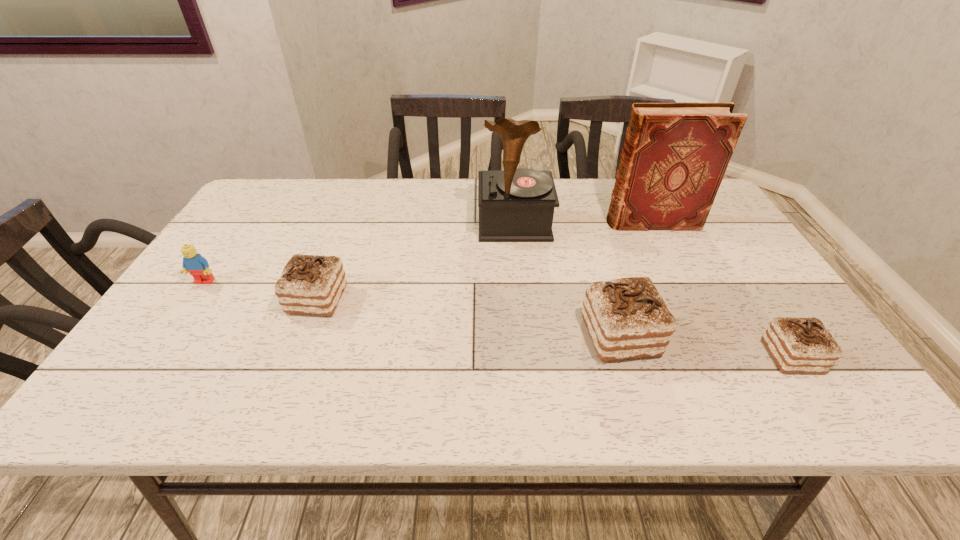
This screenshot has width=960, height=540. Identify the location of hardback book that is positioned at the right edge. (675, 155).

Locate an element on the screen. Image resolution: width=960 pixels, height=540 pixels. object that is at the far right corner is located at coordinates (675, 155).

I want to click on object present at the near right corner, so click(797, 345).

The width and height of the screenshot is (960, 540). I want to click on free space at the far edge of the desktop, so click(x=384, y=186).

Where is `free space at the near edge`? This screenshot has width=960, height=540. free space at the near edge is located at coordinates (665, 368).

In the image, there is a desktop. Where is `vacant region at the left edge`? vacant region at the left edge is located at coordinates (257, 223).

In the image, there is a desktop. At what (x,y) coordinates should I click in order to perform the action: click on vacant region at the far left corner. Please return your answer as a coordinate pair (x, y). Looking at the image, I should click on (276, 197).

What are the coordinates of `vacant space at the near left corner of the desktop` in the screenshot? It's located at (143, 342).

Where is `vacant space that is in between the fourth object from right to left and the leftmost chocolate cake`? vacant space that is in between the fourth object from right to left and the leftmost chocolate cake is located at coordinates (416, 262).

Locate an element on the screen. The image size is (960, 540). vacant area between the shortest chocolate cake and the leftmost object is located at coordinates (498, 319).